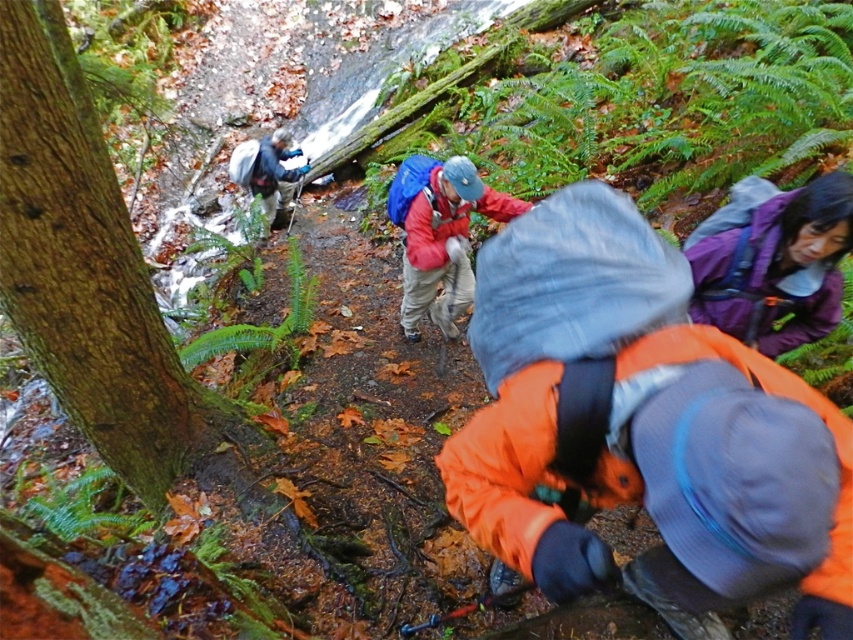
Does purple fleece jacket at upper right appear on the right side of matte red jacket at center?

Correct, you'll find purple fleece jacket at upper right to the right of matte red jacket at center.

Can you confirm if purple fleece jacket at upper right is wider than matte red jacket at center?

No.

Describe the element at coordinates (772, 260) in the screenshot. I see `purple fleece jacket at upper right` at that location.

Locate an element on the screen. purple fleece jacket at upper right is located at coordinates (772, 260).

Between orange fleece jacket at lower right and matte red jacket at center, which one has more height?

orange fleece jacket at lower right

Does orange fleece jacket at lower right have a lesser width compared to matte red jacket at center?

Incorrect, orange fleece jacket at lower right's width is not less than matte red jacket at center's.

The image size is (853, 640). In order to click on orange fleece jacket at lower right in this screenshot , I will do `click(642, 429)`.

Does orange fleece jacket at lower right have a lesser height compared to purple fleece jacket at upper right?

No.

Can you confirm if orange fleece jacket at lower right is thinner than purple fleece jacket at upper right?

Incorrect, orange fleece jacket at lower right's width is not less than purple fleece jacket at upper right's.

Is point (732, 449) closer to viewer compared to point (689, 234)?

Yes, point (732, 449) is closer to viewer.

Where is `orange fleece jacket at lower right`? Image resolution: width=853 pixels, height=640 pixels. orange fleece jacket at lower right is located at coordinates (642, 429).